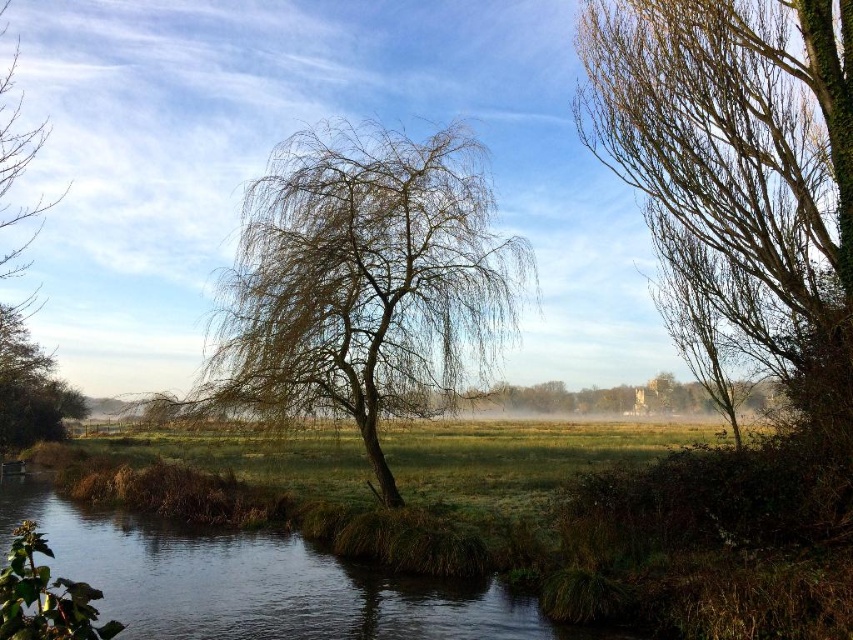
Which is above, brown textured tree at center or green grassy river at lower left?

brown textured tree at center is above.

Between brown textured tree at center and green grassy river at lower left, which one appears on the left side from the viewer's perspective?

Positioned to the left is green grassy river at lower left.

What do you see at coordinates (363, 282) in the screenshot? I see `brown textured tree at center` at bounding box center [363, 282].

Locate an element on the screen. This screenshot has height=640, width=853. brown textured tree at center is located at coordinates (363, 282).

Can you confirm if green grassy river at lower left is positioned to the left of brown leafy tree at upper left?

Incorrect, green grassy river at lower left is not on the left side of brown leafy tree at upper left.

Is green grassy river at lower left above brown leafy tree at upper left?

Actually, green grassy river at lower left is below brown leafy tree at upper left.

Where is `green grassy river at lower left`? green grassy river at lower left is located at coordinates [254, 582].

Between foggy mist at center and green grassy river at lower left, which one appears on the right side from the viewer's perspective?

foggy mist at center is more to the right.

Can you confirm if foggy mist at center is positioned below green grassy river at lower left?

Incorrect, foggy mist at center is not positioned below green grassy river at lower left.

This screenshot has width=853, height=640. In order to click on foggy mist at center in this screenshot , I will do `click(282, 138)`.